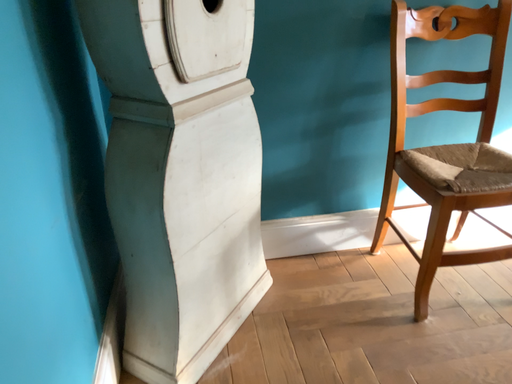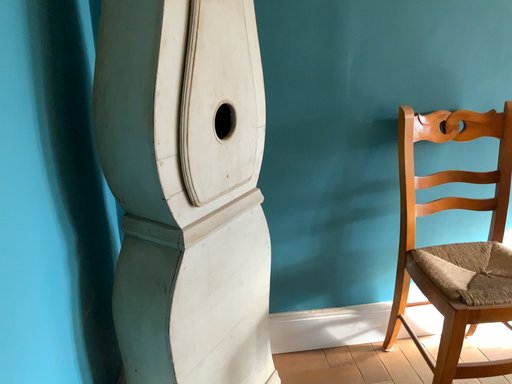
Question: Which way did the camera rotate in the video?

Choices:
 (A) rotated downward
 (B) rotated upward

Answer: (B)